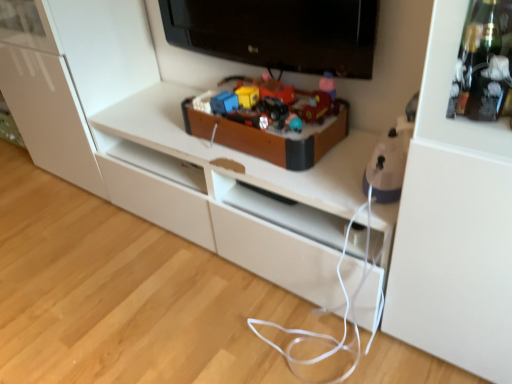
Find the location of `free spot above wooden toy box at center, positioned as the 1th toy in back-to-front order (from a real-world perspective)`. free spot above wooden toy box at center, positioned as the 1th toy in back-to-front order (from a real-world perspective) is located at coordinates (246, 105).